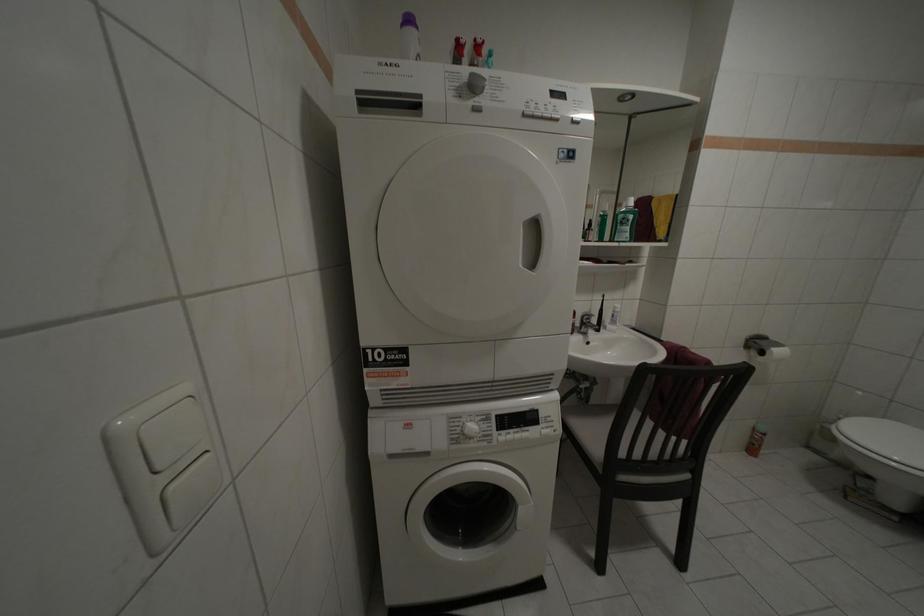
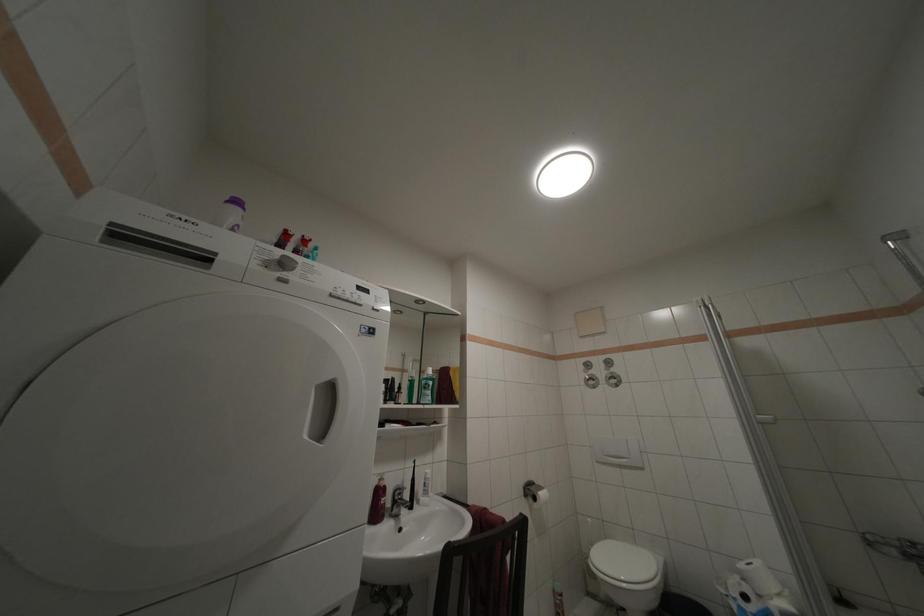
The first image is from the beginning of the video and the second image is from the end. How did the camera likely rotate when shooting the video?

The rotation direction of the camera is right-up.